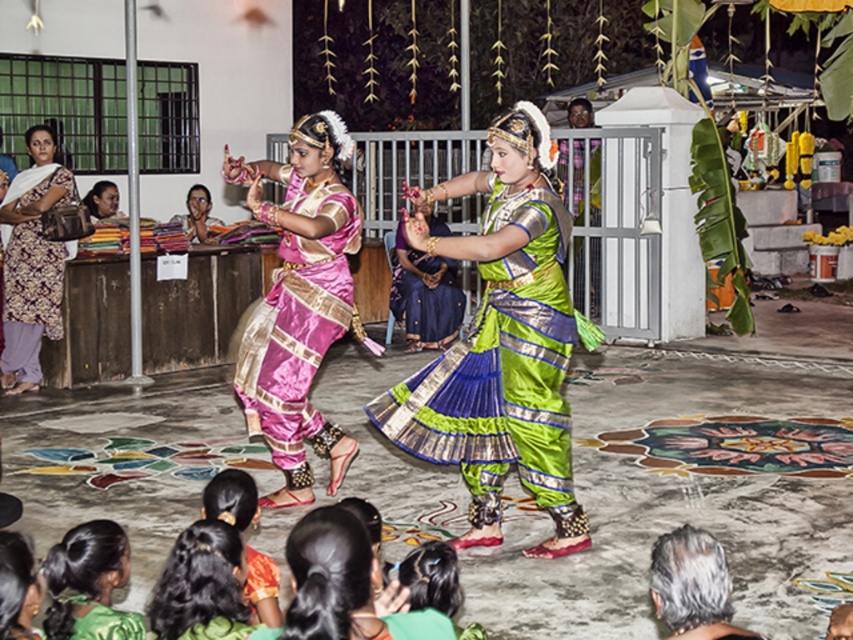
You are a photographer at the event and want to capture both the green silk saree at center and the green silk saree at lower left in a single frame. Which of the two green silk sarees should you focus on to ensure the wider one is properly framed?

The green silk saree at center is wider than the green silk saree at lower left. To ensure the wider one is properly framed, focus on the green silk saree at center.